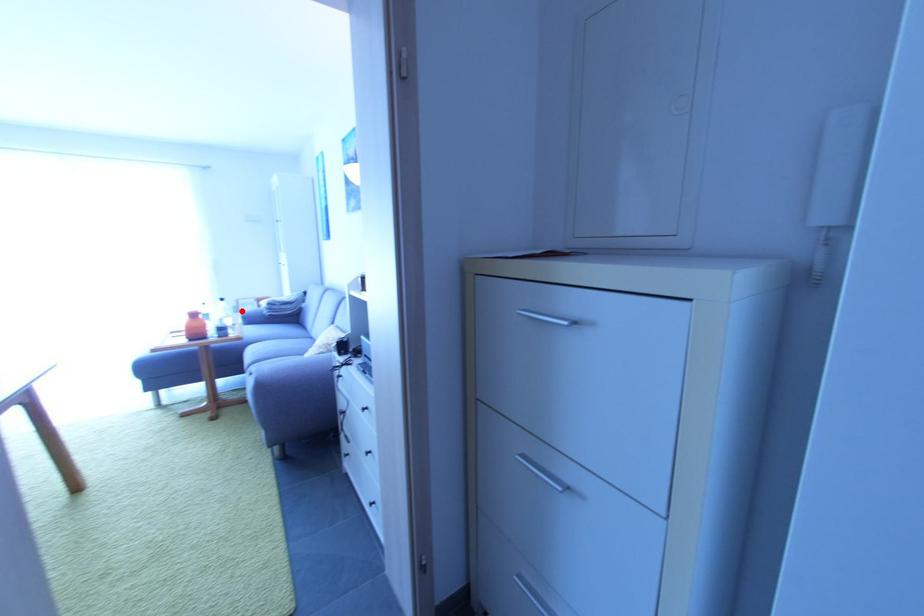
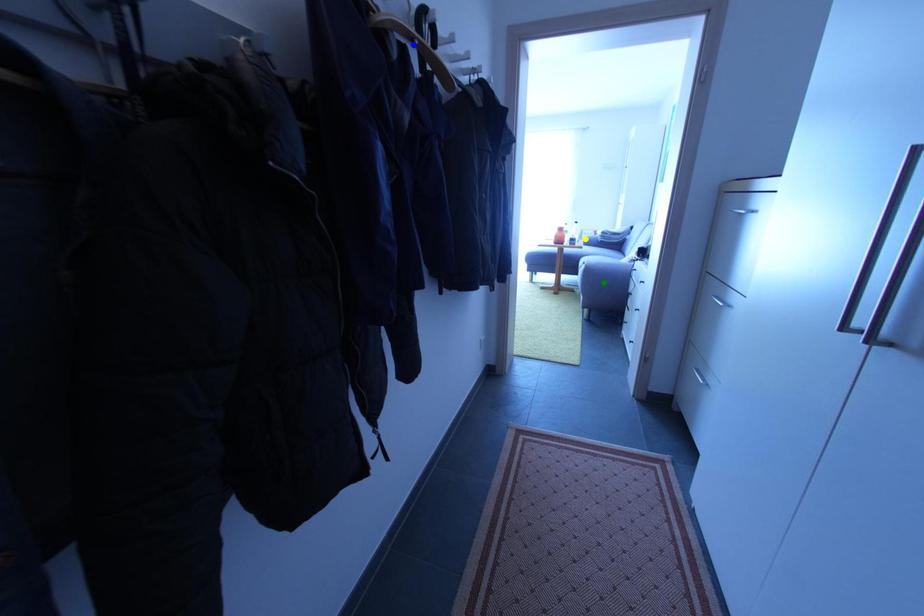
Question: I am providing you with two images of the same scene from different viewpoints. A red point is marked on the first image. You are given multiple points on the second image. Which mark in image 2 goes with the point in image 1?

Choices:
 (A) green point
 (B) blue point
 (C) yellow point

Answer: (C)